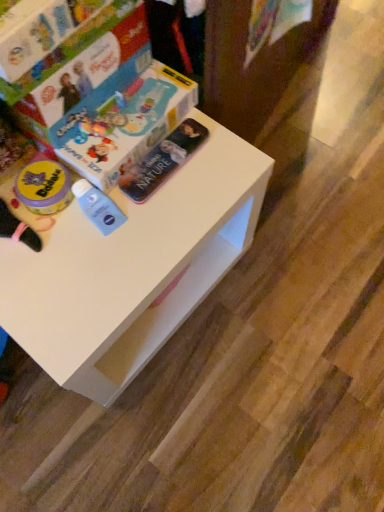
Where is `empty space that is ontop of white matte table at center (from a real-world perspective)`? The width and height of the screenshot is (384, 512). empty space that is ontop of white matte table at center (from a real-world perspective) is located at coordinates (107, 217).